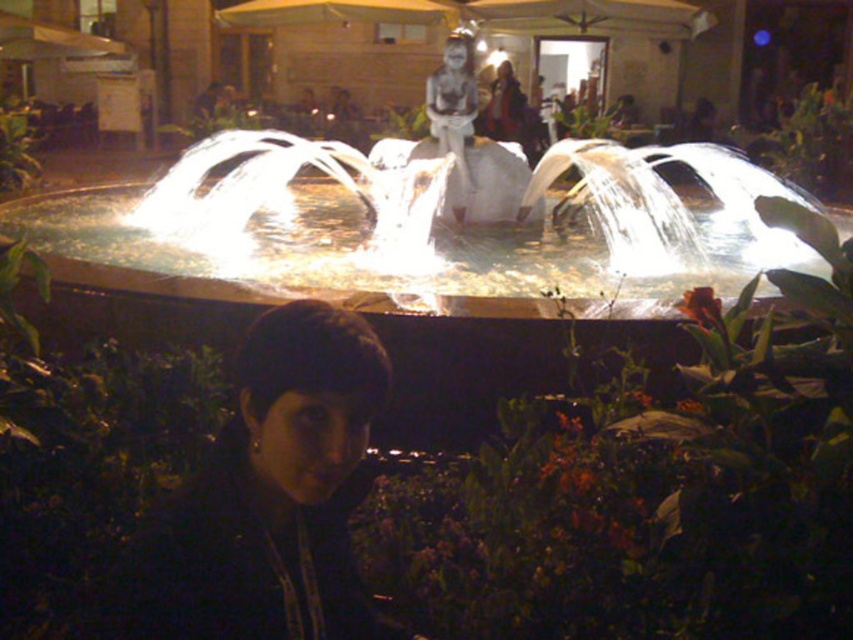
Question: Is illuminated stone fountain at center to the left of dark matte hair at lower center from the viewer's perspective?

Choices:
 (A) yes
 (B) no

Answer: (A)

Question: Does illuminated stone fountain at center have a greater width compared to dark matte hair at lower center?

Choices:
 (A) no
 (B) yes

Answer: (B)

Question: Does illuminated stone fountain at center have a larger size compared to dark matte hair at lower center?

Choices:
 (A) yes
 (B) no

Answer: (A)

Question: Among these points, which one is farthest from the camera?

Choices:
 (A) [x=399, y=228]
 (B) [x=144, y=627]

Answer: (A)

Question: Which point is closer to the camera?

Choices:
 (A) dark matte hair at lower center
 (B) illuminated stone fountain at center

Answer: (A)